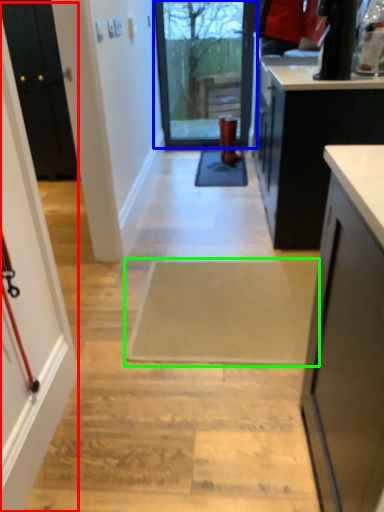
Question: Which is nearer to the screen door (highlighted by a red box)? glass door (highlighted by a blue box) or doormat (highlighted by a green box).

Choices:
 (A) glass door
 (B) doormat

Answer: (B)